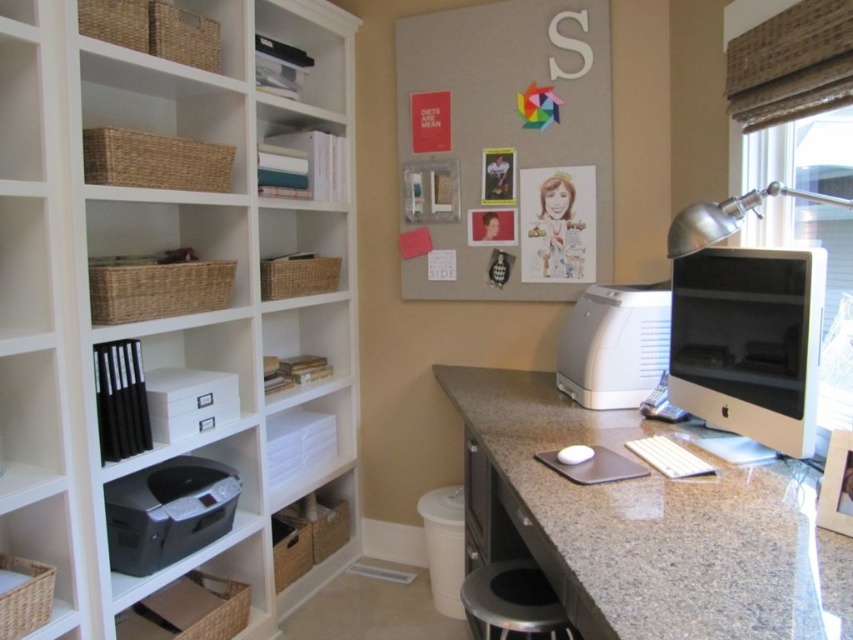
Does white wood bookshelf at left appear over matte gray printer at center?

Indeed, white wood bookshelf at left is positioned over matte gray printer at center.

Is point (39, 300) positioned before point (624, 330)?

Yes.

Where is `white wood bookshelf at left`? The image size is (853, 640). white wood bookshelf at left is located at coordinates (154, 252).

Can you confirm if matte gray bulletin board at upper center is thinner than metallic silver stool at lower center?

No, matte gray bulletin board at upper center is not thinner than metallic silver stool at lower center.

Does point (492, 260) come closer to viewer compared to point (527, 611)?

No, it is not.

Which is behind, point (560, 108) or point (534, 625)?

The point (560, 108) is behind.

Where is `matte gray bulletin board at upper center`? matte gray bulletin board at upper center is located at coordinates (506, 148).

Can you confirm if granite desk at lower right is shorter than matte gray bulletin board at upper center?

Yes, granite desk at lower right is shorter than matte gray bulletin board at upper center.

Based on the photo, does granite desk at lower right appear over matte gray bulletin board at upper center?

Incorrect, granite desk at lower right is not positioned above matte gray bulletin board at upper center.

Describe the element at coordinates (643, 525) in the screenshot. I see `granite desk at lower right` at that location.

Where is `granite desk at lower right`? The image size is (853, 640). granite desk at lower right is located at coordinates tap(643, 525).